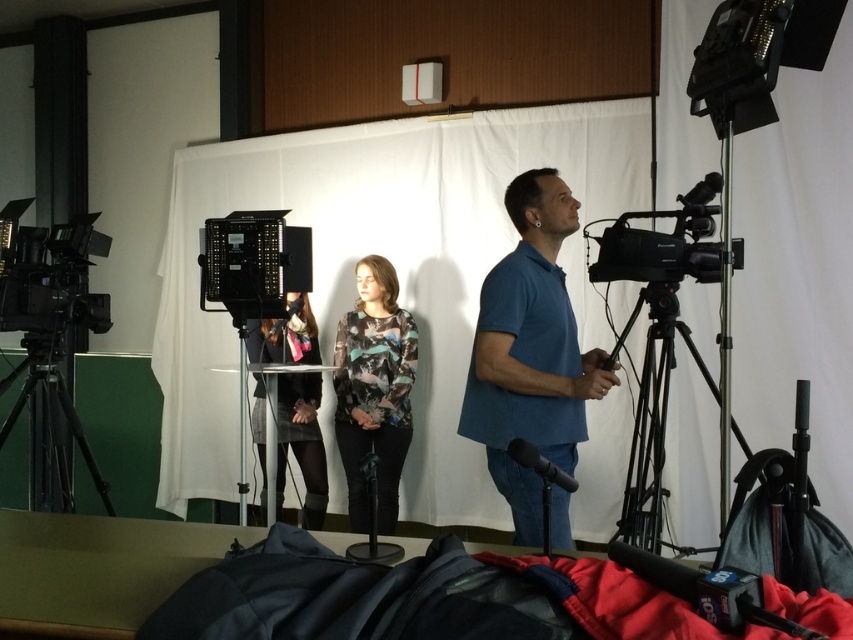
Between blue cotton shirt at center and dark gray fabric dress at center, which one is positioned higher?

Positioned higher is blue cotton shirt at center.

Between blue cotton shirt at center and dark gray fabric dress at center, which one is positioned lower?

dark gray fabric dress at center is below.

Find the location of a particular element. This screenshot has width=853, height=640. blue cotton shirt at center is located at coordinates (531, 353).

Is floral-patterned fabric at center further to the viewer compared to dark gray fabric dress at center?

No, floral-patterned fabric at center is in front of dark gray fabric dress at center.

Who is positioned more to the left, floral-patterned fabric at center or dark gray fabric dress at center?

dark gray fabric dress at center

This screenshot has height=640, width=853. Find the location of `floral-patterned fabric at center`. floral-patterned fabric at center is located at coordinates (374, 390).

Does floral-patterned fabric at center appear on the right side of black matte tripod at left?

Correct, you'll find floral-patterned fabric at center to the right of black matte tripod at left.

The height and width of the screenshot is (640, 853). In order to click on floral-patterned fabric at center in this screenshot , I will do `click(374, 390)`.